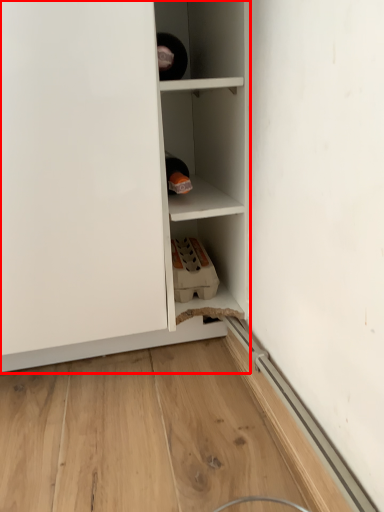
Question: Observing the image, what is the correct spatial positioning of cupboard (annotated by the red box) in reference to cabinetry?

Choices:
 (A) left
 (B) right

Answer: (A)